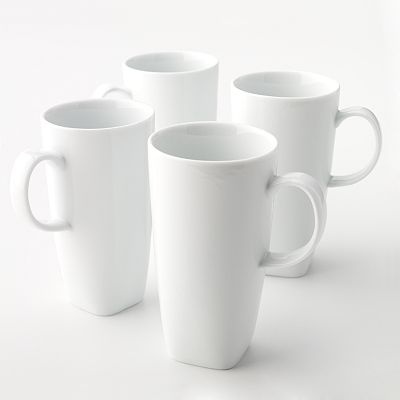
Locate an element on the screen. coffee cups is located at coordinates (89, 130), (163, 73), (278, 108), (221, 198).